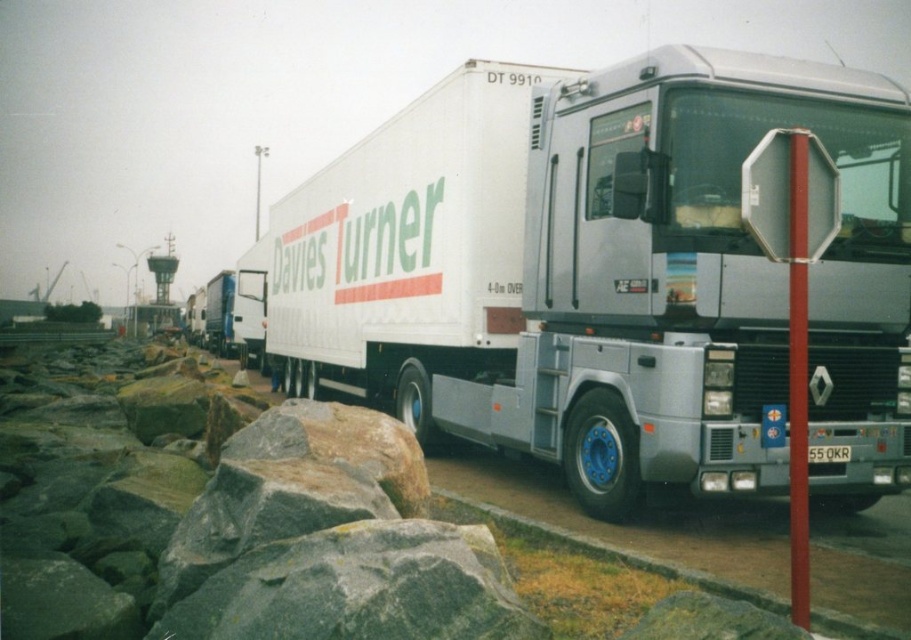
You are a delivery driver who needs to park your truck at the rocky shoreline. The parking spot is marked by the point at coordinates (604, 275). Can you safely park your truck there?

The white matte trailer truck at center is represented by point (604, 275), so yes, you can safely park your truck there as the parking spot is exactly where the truck is currently positioned.

You are driving a truck and need to pass under a bridge that has a height restriction. You see the white matte trailer truck at center and the red plastic pole at center right in your rearview mirror. Which object is closer to you, the driver?

The white matte trailer truck at center is closer to you because the red plastic pole at center right is behind it.